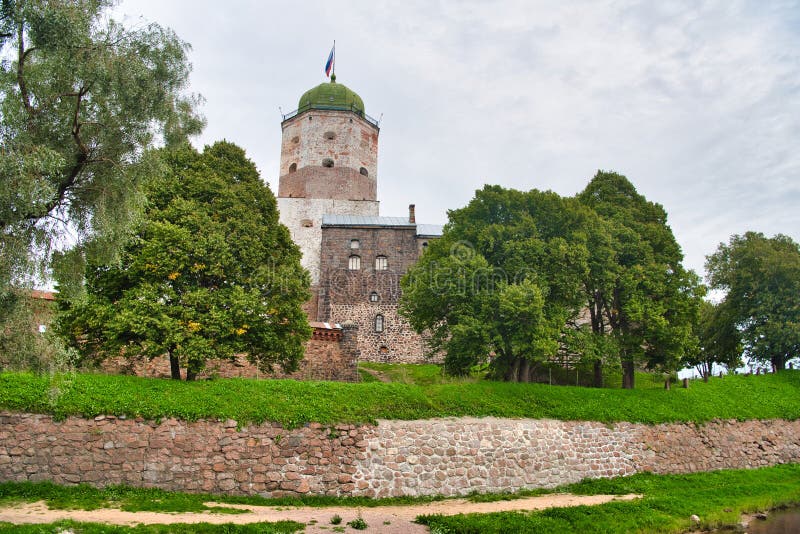
Identify the location of window. (378, 321).